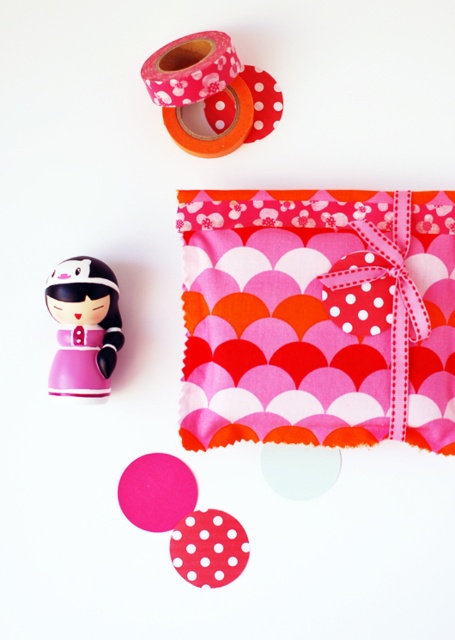
Question: Which of the following is the closest to the observer?

Choices:
 (A) (79, 294)
 (B) (181, 465)
 (C) (237, 100)
 (D) (318, 268)

Answer: (A)

Question: Is pink scalloped fabric at upper center smaller than pink matte doll at upper left?

Choices:
 (A) no
 (B) yes

Answer: (A)

Question: Observing the image, what is the correct spatial positioning of pink felt circle at lower left in reference to polka dot paper at center?

Choices:
 (A) above
 (B) below

Answer: (A)

Question: Estimate the real-world distances between objects in this image. Which object is farther from the polka dot paper at center?

Choices:
 (A) pink scalloped fabric at upper center
 (B) pink felt circle at lower left
 (C) pink matte washi tape at upper center

Answer: (C)

Question: In this image, where is pink matte doll at upper left located relative to polka dot paper at center?

Choices:
 (A) below
 (B) above

Answer: (B)

Question: Among these points, which one is farthest from the camera?

Choices:
 (A) (212, 54)
 (B) (319, 204)

Answer: (B)